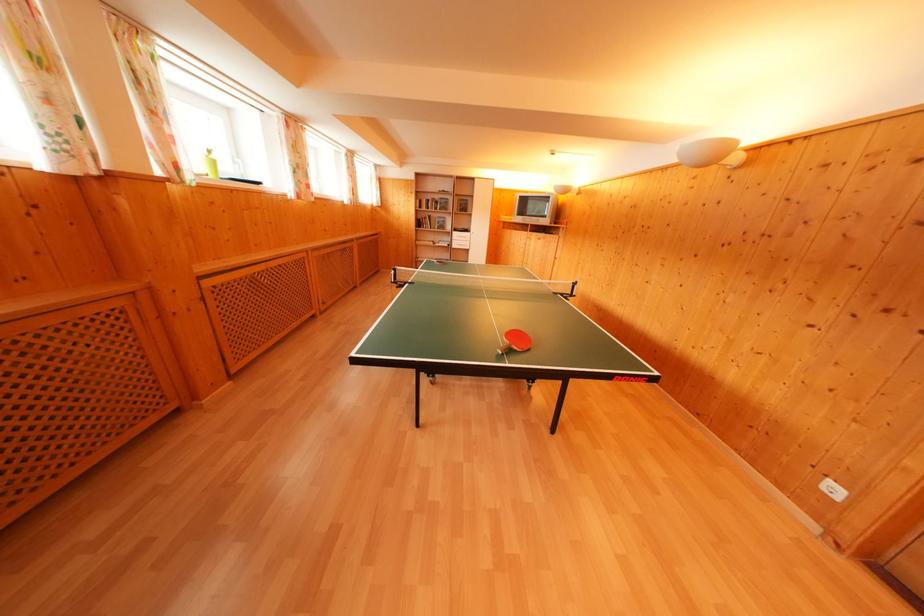
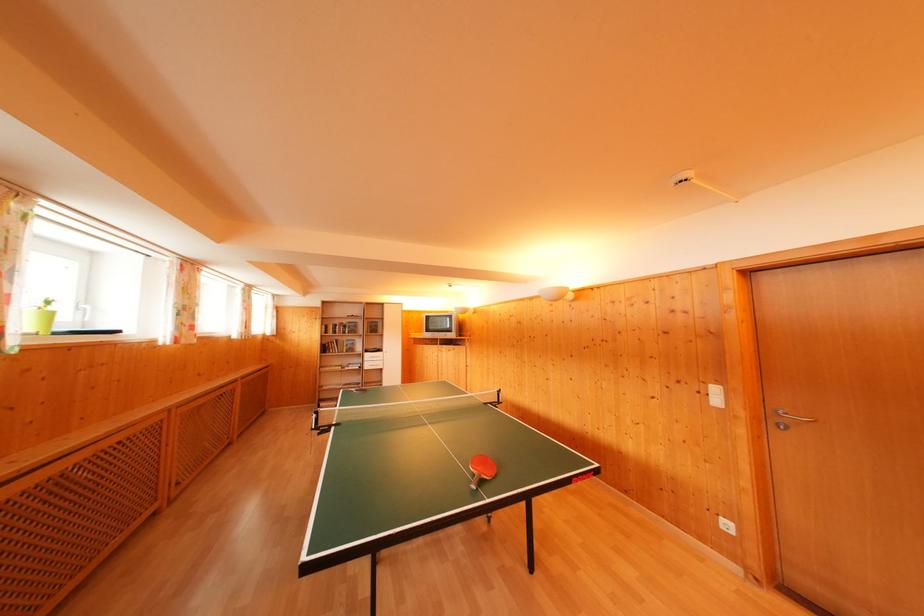
Locate, in the second image, the point that corresponds to [421,216] in the first image.

(326, 342)